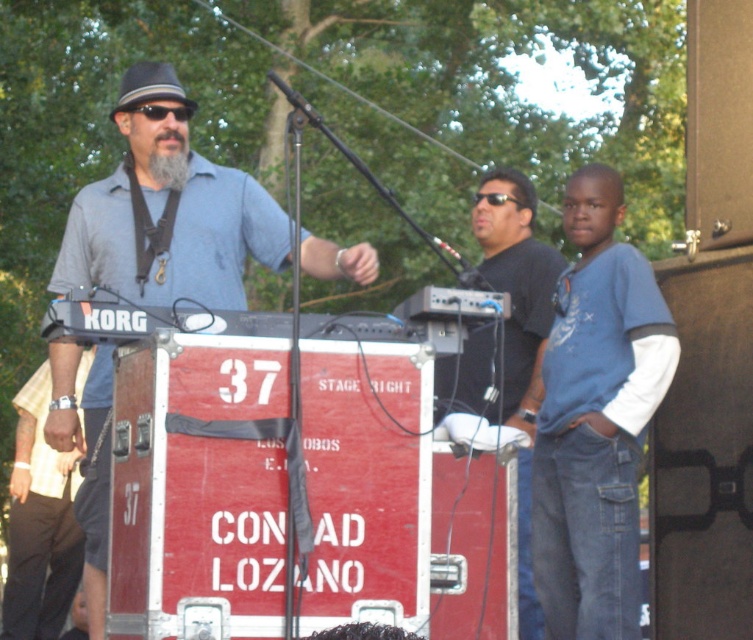
You are a photographer at the event and need to capture a closeup of both the blue cotton shirt at right and the brown leather wristwatch at left. Which object should you zoom in on more to ensure both are clearly visible in the photo?

The blue cotton shirt at right is smaller than the brown leather wristwatch at left, so you should zoom in more on the blue cotton shirt at right to ensure both are clearly visible.

You are a photographer at the event and need to focus your camera on the blue cotton shirt at right and the brown leather wristwatch at left. Which object should you adjust your focus to first to ensure both are in the frame?

The blue cotton shirt at right is closer to the viewer than the brown leather wristwatch at left. To ensure both are in focus, you should adjust your focus starting with the blue cotton shirt at right first, as it is closer, and then adjust for the brown leather wristwatch at left.